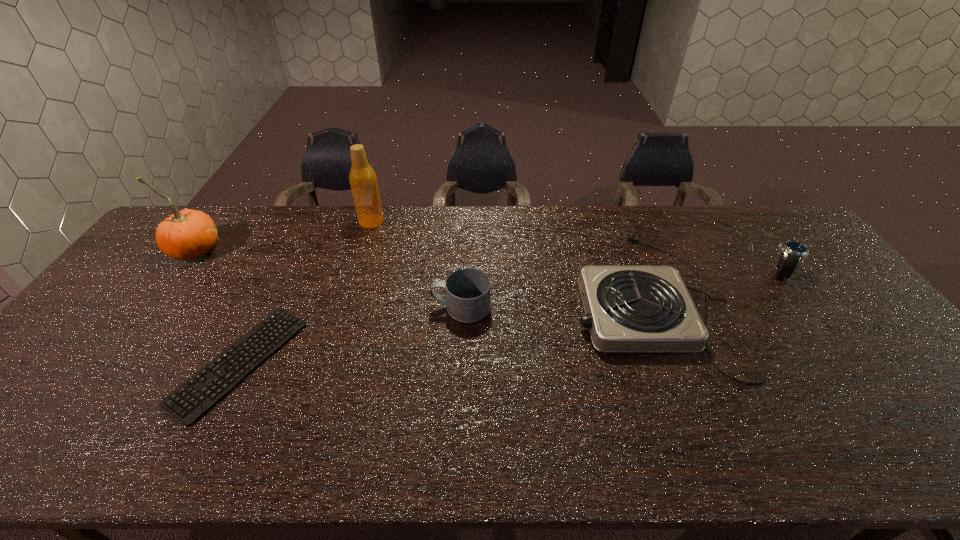
At what (x,y) coordinates should I click in order to perform the action: click on pumpkin at the far edge. Please return your answer as a coordinate pair (x, y). The image size is (960, 540). Looking at the image, I should click on (186, 234).

Where is `hotplate that is at the far edge`? This screenshot has width=960, height=540. hotplate that is at the far edge is located at coordinates (629, 308).

I want to click on object at the near edge, so click(194, 398).

The height and width of the screenshot is (540, 960). Identify the location of object located in the left edge section of the desktop. (186, 234).

Find the location of a particular element. This screenshot has width=960, height=540. object present at the right edge is located at coordinates coord(793,252).

I want to click on object that is positioned at the far left corner, so click(x=186, y=234).

Where is `vacant area at the far edge of the desktop`? The width and height of the screenshot is (960, 540). vacant area at the far edge of the desktop is located at coordinates (299, 240).

I want to click on vacant space at the near edge of the desktop, so click(95, 431).

Where is `vacant space at the near right corner of the desktop`? The height and width of the screenshot is (540, 960). vacant space at the near right corner of the desktop is located at coordinates (924, 436).

The height and width of the screenshot is (540, 960). In order to click on free point between the watch and the pumpkin in this screenshot , I will do `click(488, 261)`.